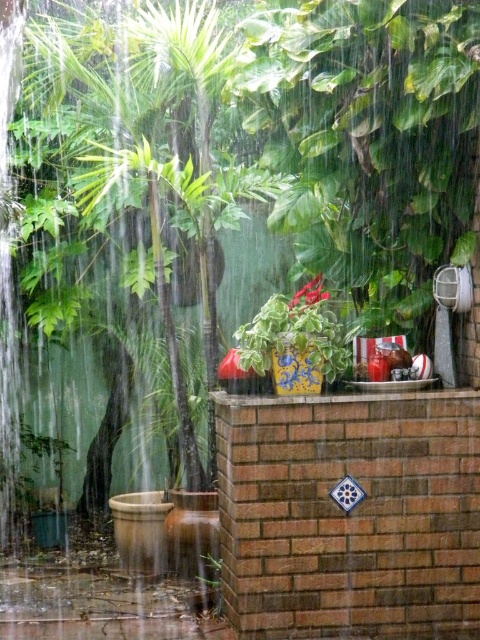
You are a gardener trying to place a new plant in the garden. You see the blue and white ceramic pot at center and the green matte plant at lower center. Which object is located to the right of the other?

The blue and white ceramic pot at center is positioned on the right side of green matte plant at lower center.

You are a gardener who wants to water the green matte plant at lower center. The blue and white ceramic pot at center is blocking access to it. Can you move the pot to reach the plant?

The blue and white ceramic pot at center is positioned over the green matte plant at lower center, so moving the pot would allow access to the plant.